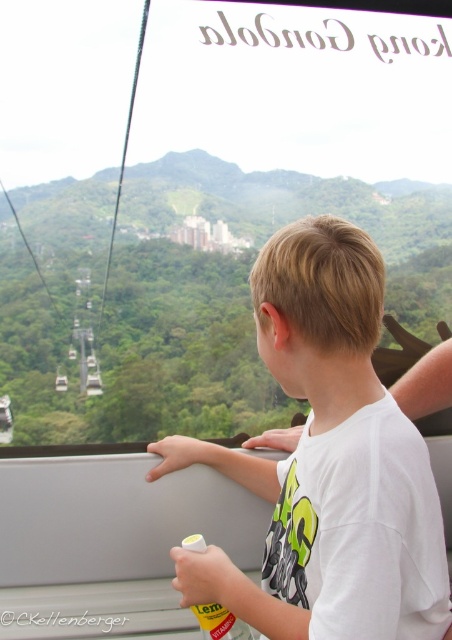
Is point (300, 257) positioned in front of point (216, 630)?

That is True.

Where is `white cotton shirt at center`? The width and height of the screenshot is (452, 640). white cotton shirt at center is located at coordinates (328, 461).

At what (x,y) coordinates should I click in order to perform the action: click on white cotton shirt at center. Please return your answer as a coordinate pair (x, y). The image size is (452, 640). Looking at the image, I should click on (328, 461).

Where is `white cotton shirt at center`? The image size is (452, 640). white cotton shirt at center is located at coordinates tap(328, 461).